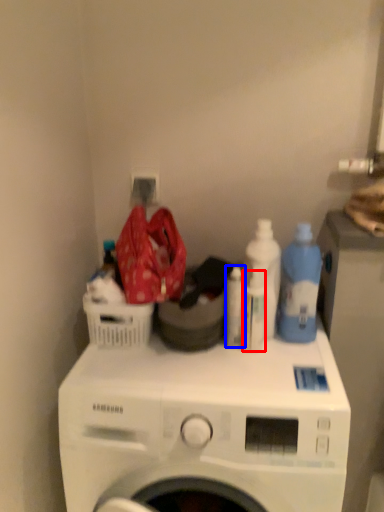
Question: Which object appears closest to the camera in this image, bottle (highlighted by a red box) or cleaning product (highlighted by a blue box)?

Choices:
 (A) bottle
 (B) cleaning product

Answer: (A)